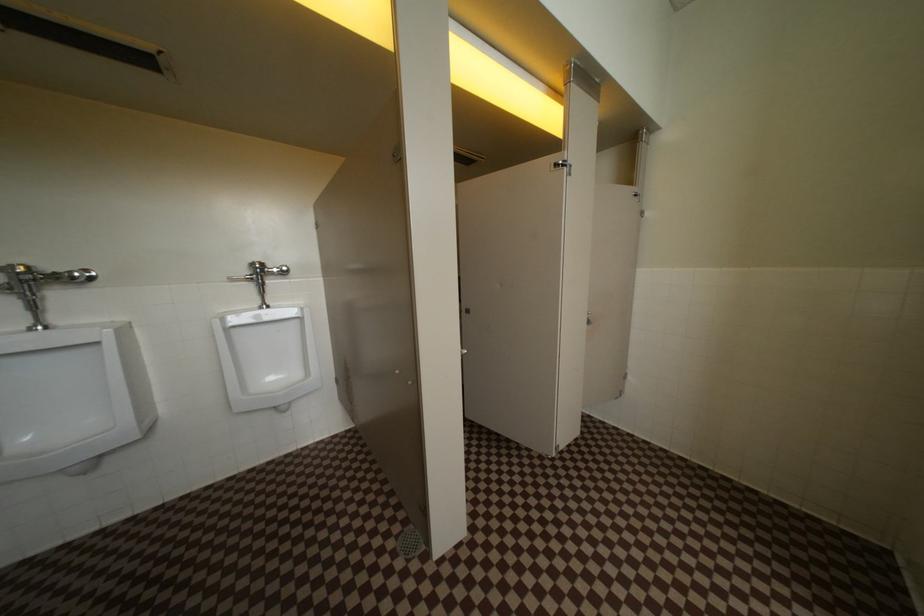
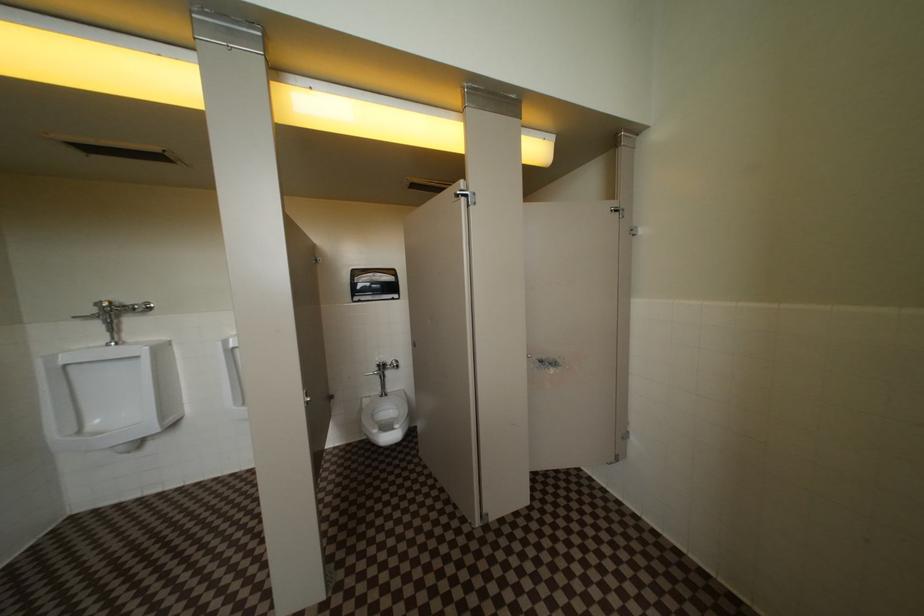
Question: What movement of the cameraman would produce the second image?

Choices:
 (A) Left
 (B) Right
 (C) Forward
 (D) Backward

Answer: (B)